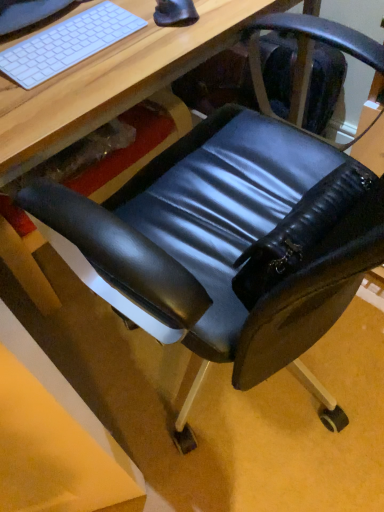
Question: From the image's perspective, is white matte keyboard at upper left located above matte black chair at lower right?

Choices:
 (A) no
 (B) yes

Answer: (B)

Question: Is white matte keyboard at upper left not inside matte black chair at lower right?

Choices:
 (A) yes
 (B) no

Answer: (B)

Question: From a real-world perspective, is white matte keyboard at upper left beneath matte black chair at lower right?

Choices:
 (A) no
 (B) yes

Answer: (A)

Question: Does white matte keyboard at upper left have a smaller size compared to matte black chair at lower right?

Choices:
 (A) yes
 (B) no

Answer: (A)

Question: Are white matte keyboard at upper left and matte black chair at lower right far apart?

Choices:
 (A) no
 (B) yes

Answer: (A)

Question: Is matte black chair at lower right a part of white matte keyboard at upper left?

Choices:
 (A) yes
 (B) no

Answer: (B)

Question: From a real-world perspective, is matte black chair at lower right located beneath black leather swivel chair at center?

Choices:
 (A) no
 (B) yes

Answer: (A)

Question: Considering the relative sizes of matte black chair at lower right and black leather swivel chair at center in the image provided, is matte black chair at lower right wider than black leather swivel chair at center?

Choices:
 (A) yes
 (B) no

Answer: (B)

Question: Is matte black chair at lower right positioned with its back to black leather swivel chair at center?

Choices:
 (A) no
 (B) yes

Answer: (A)

Question: Can you confirm if matte black chair at lower right is taller than black leather swivel chair at center?

Choices:
 (A) yes
 (B) no

Answer: (A)

Question: Does matte black chair at lower right turn towards black leather swivel chair at center?

Choices:
 (A) no
 (B) yes

Answer: (A)

Question: Is matte black chair at lower right next to black leather swivel chair at center and touching it?

Choices:
 (A) no
 (B) yes

Answer: (A)

Question: Could you tell me if white matte keyboard at upper left is turned towards black rubber mouse at upper center?

Choices:
 (A) yes
 (B) no

Answer: (B)